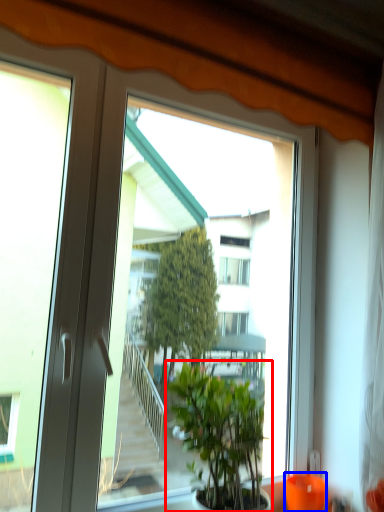
Question: Which object is further to the camera taking this photo, houseplant (highlighted by a red box) or glass vase (highlighted by a blue box)?

Choices:
 (A) houseplant
 (B) glass vase

Answer: (B)